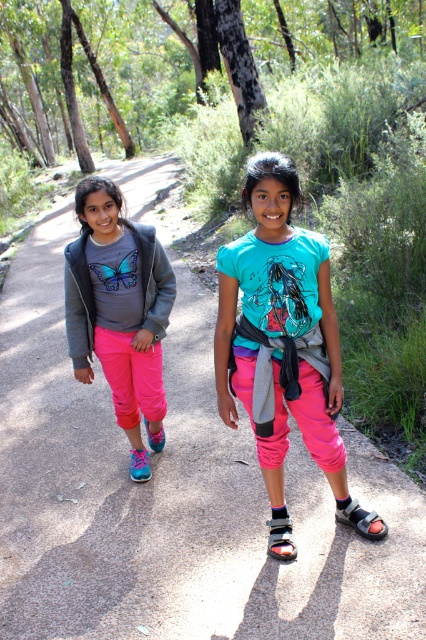
Based on the photo, you are standing at the point marked as point (x=281, y=538). Which object is exactly at your current location?

The black leather sandal at lower center is exactly at point (x=281, y=538).

You are standing at the camera position and want to reach the point marked at coordinates (276, 524). The path is 10 feet wide. Can you walk straight to the point without stepping off the path?

The point marked at coordinates (276, 524) is 9.85 feet away from the camera, which is within the 10 feet width of the path. Therefore, you can walk straight to the point without stepping off the path.